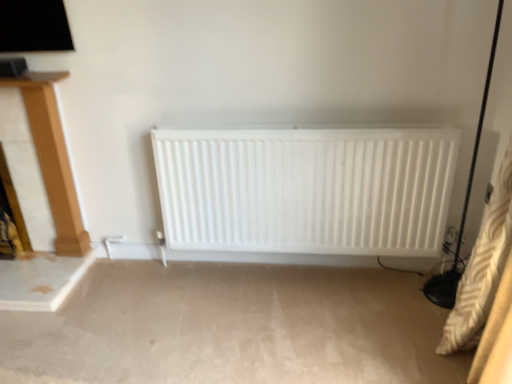
This screenshot has width=512, height=384. What do you see at coordinates (306, 190) in the screenshot?
I see `white matte radiator at center` at bounding box center [306, 190].

This screenshot has height=384, width=512. What are the coordinates of `white matte radiator at center` in the screenshot? It's located at (306, 190).

You are a GUI agent. You are given a task and a screenshot of the screen. Output one action in this format:
    pyautogui.click(x=<x>, y=<y>)
    Task: Click on the wooden fireplace at left
    
    Given the screenshot: What is the action you would take?
    pyautogui.click(x=53, y=158)

The height and width of the screenshot is (384, 512). What do you see at coordinates (53, 158) in the screenshot?
I see `wooden fireplace at left` at bounding box center [53, 158].

You are a GUI agent. You are given a task and a screenshot of the screen. Output one action in this format:
    pyautogui.click(x=<x>, y=<y>)
    Task: Click on the white matte radiator at center
    The width and height of the screenshot is (512, 384).
    Given the screenshot: What is the action you would take?
    pyautogui.click(x=306, y=190)

Is white matte radiator at center to the left or to the right of wooden fireplace at left in the image?

In the image, white matte radiator at center appears on the right side of wooden fireplace at left.

Is white matte radiator at center positioned behind wooden fireplace at left?

No, white matte radiator at center is closer to the camera.

Which is behind, point (230, 188) or point (59, 118)?

The point (59, 118) is farther from the camera.

Based on the photo, from the image's perspective, is white matte radiator at center above or below wooden fireplace at left?

Based on their image positions, white matte radiator at center is located beneath wooden fireplace at left.

From a real-world perspective, is white matte radiator at center physically located above or below wooden fireplace at left?

white matte radiator at center is below wooden fireplace at left.

Is white matte radiator at center wider than wooden fireplace at left?

Indeed, white matte radiator at center has a greater width compared to wooden fireplace at left.

Considering the relative sizes of white matte radiator at center and wooden fireplace at left in the image provided, is white matte radiator at center taller than wooden fireplace at left?

In fact, white matte radiator at center may be shorter than wooden fireplace at left.

Considering the relative sizes of white matte radiator at center and wooden fireplace at left in the image provided, is white matte radiator at center bigger than wooden fireplace at left?

Yes, white matte radiator at center is bigger than wooden fireplace at left.

Can we say white matte radiator at center lies outside wooden fireplace at left?

Indeed, white matte radiator at center is completely outside wooden fireplace at left.

Is white matte radiator at center not close to wooden fireplace at left?

No, white matte radiator at center is not far away from wooden fireplace at left.

Is white matte radiator at center oriented towards wooden fireplace at left?

No, white matte radiator at center is not facing towards wooden fireplace at left.

Based on the photo, how many degrees apart are the facing directions of white matte radiator at center and wooden fireplace at left?

They differ by 0.339 degrees in their facing directions.

Locate an element on the screen. The image size is (512, 384). furniture above the white matte radiator at center (from the image's perspective) is located at coordinates (53, 158).

Between wooden fireplace at left and white matte radiator at center, which one appears on the left side from the viewer's perspective?

From the viewer's perspective, wooden fireplace at left appears more on the left side.

Which object is closer to the camera, wooden fireplace at left or white matte radiator at center?

Positioned in front is white matte radiator at center.

Is point (69, 175) closer or farther from the camera than point (378, 213)?

Point (69, 175) is farther from the camera than point (378, 213).

From the image's perspective, which object appears higher, wooden fireplace at left or white matte radiator at center?

From the image's view, wooden fireplace at left is above.

Looking at this image, from a real-world perspective, which is physically below, wooden fireplace at left or white matte radiator at center?

white matte radiator at center.

Considering the sizes of wooden fireplace at left and white matte radiator at center in the image, is wooden fireplace at left wider or thinner than white matte radiator at center?

Considering their sizes, wooden fireplace at left looks slimmer than white matte radiator at center.

Considering the sizes of objects wooden fireplace at left and white matte radiator at center in the image provided, who is shorter, wooden fireplace at left or white matte radiator at center?

With less height is white matte radiator at center.

Which of these two, wooden fireplace at left or white matte radiator at center, is smaller?

wooden fireplace at left is smaller.

Choose the correct answer: Is wooden fireplace at left inside white matte radiator at center or outside it?

wooden fireplace at left exists outside the volume of white matte radiator at center.

Is wooden fireplace at left far from white matte radiator at center?

→ No, there isn't a large distance between wooden fireplace at left and white matte radiator at center.

Does wooden fireplace at left turn towards white matte radiator at center?

No.

From the picture: What's the angular difference between wooden fireplace at left and white matte radiator at center's facing directions?

They differ by 0.339 degrees in their facing directions.

In order to click on radiator in front of the wooden fireplace at left in this screenshot , I will do `click(306, 190)`.

Where is `furniture to the left of white matte radiator at center`? The image size is (512, 384). furniture to the left of white matte radiator at center is located at coordinates (53, 158).

Locate an element on the screen. This screenshot has width=512, height=384. radiator in front of the wooden fireplace at left is located at coordinates (306, 190).